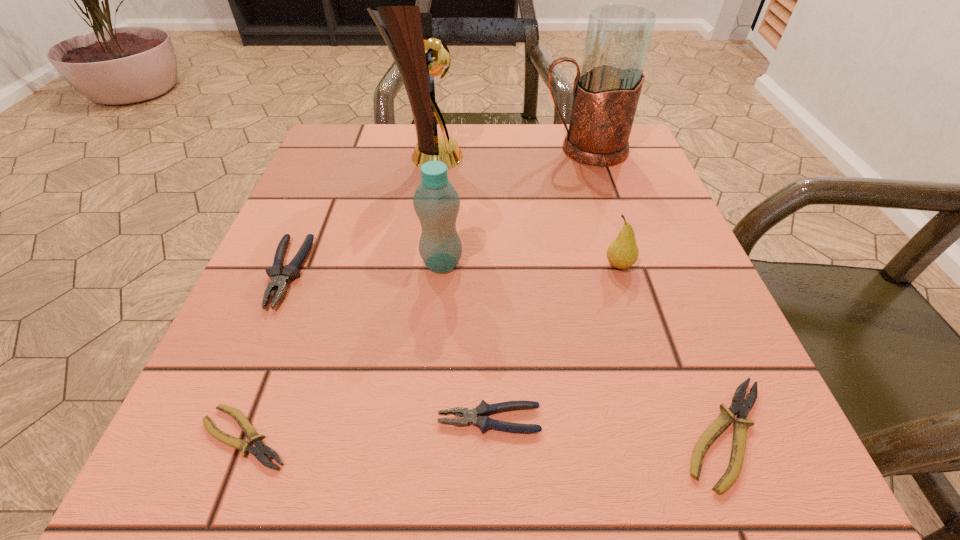
Identify the location of object that stands as the fourth closest to the right yellow pliers. (260, 450).

At what (x,y) coordinates should I click in order to perform the action: click on object that is the fifth closest one to the award. Please return your answer as a coordinate pair (x, y). Image resolution: width=960 pixels, height=540 pixels. Looking at the image, I should click on point(483,410).

Identify which pliers is the second closest to the sixth shortest object. Please provide its 2D coordinates. Your answer should be formatted as a tuple, i.e. [(x, y)], where the tuple contains the x and y coordinates of a point satisfying the conditions above.

[(483, 410)]

This screenshot has height=540, width=960. I want to click on pliers that is the second closest to the second pliers from right to left, so click(260, 450).

Identify the location of free spot that satisfies the following two spatial constraints: 1. at the front of the award, where the globe is visible; 2. at the gripping part of the tallest pliers. (409, 273).

Locate an element on the screen. vacant position in the image that satisfies the following two spatial constraints: 1. at the front of the award, where the globe is visible; 2. on the back side of the pear is located at coordinates (410, 265).

Identify the location of blank area in the image that satisfies the following two spatial constraints: 1. at the front cap of the water bottle; 2. on the right side of the third tallest pliers. [427, 434].

Find the location of a particular element. vacant space that satisfies the following two spatial constraints: 1. at the front of the black award, where the globe is visible; 2. on the back side of the pear is located at coordinates (410, 265).

The width and height of the screenshot is (960, 540). I want to click on blank area in the image that satisfies the following two spatial constraints: 1. at the front of the black award, where the globe is visible; 2. at the gripping part of the farthest pliers, so click(x=409, y=273).

Identify the location of vacant position in the image that satisfies the following two spatial constraints: 1. at the gripping part of the farthest pliers; 2. on the right side of the smaller yellow pliers. The image size is (960, 540). (217, 437).